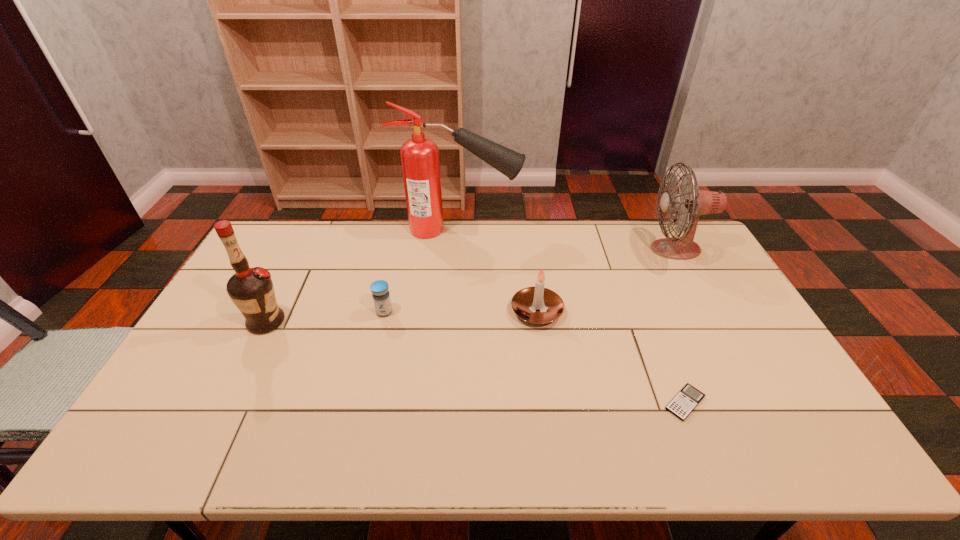
At what (x,y) coordinates should I click in order to perform the action: click on the tallest object. Please return your answer as a coordinate pair (x, y). Looking at the image, I should click on (420, 162).

You are a GUI agent. You are given a task and a screenshot of the screen. Output one action in this format:
    pyautogui.click(x=<x>, y=<y>)
    Task: Click on the liquor
    
    Given the screenshot: What is the action you would take?
    pyautogui.click(x=251, y=289)

The height and width of the screenshot is (540, 960). I want to click on the rightmost object, so click(x=690, y=201).

Find the location of `the fourth tallest object`. the fourth tallest object is located at coordinates (538, 305).

Identify the location of medicine. tap(381, 297).

The width and height of the screenshot is (960, 540). I want to click on the second object from right to left, so click(689, 397).

What are the coordinates of `the shortest object` in the screenshot? It's located at (689, 397).

Image resolution: width=960 pixels, height=540 pixels. I want to click on vacant area located 0.100m at the nozzle of the tallest object, so click(547, 230).

Where is `vacant space positioned 0.080m on the front and back of the leftmost object`? vacant space positioned 0.080m on the front and back of the leftmost object is located at coordinates (312, 322).

The height and width of the screenshot is (540, 960). I want to click on vacant space situated in front of the fan to direct airflow, so click(609, 249).